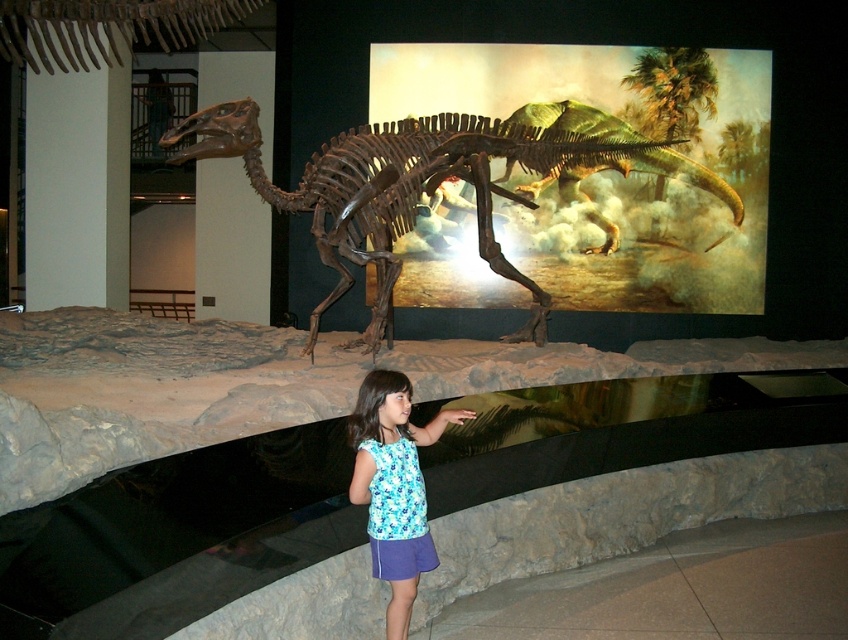
You are a museum visitor standing in front of the dinosaur skeleton exhibit. You notice the brown bone at center and the blue printed tank top at center. Which object is taller?

The brown bone at center is much taller than the blue printed tank top at center.

You are a museum visitor standing in front of the dinosaur skeleton exhibit. You notice the brown bone at center and the blue printed tank top at center. Which object is higher in position?

The brown bone at center is above the blue printed tank top at center, so the brown bone at center is higher in position.